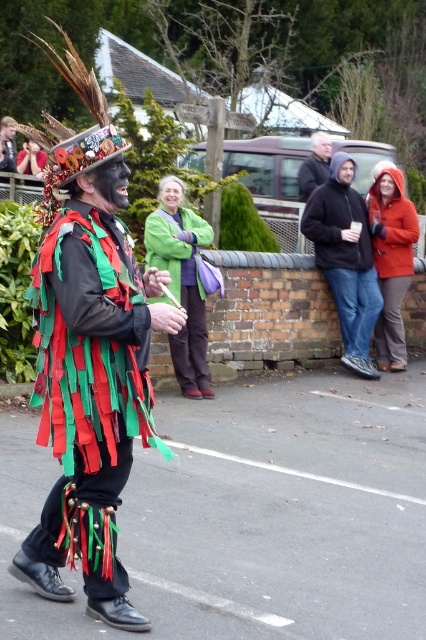
Between felt/tissue vest at center and orange fuzzy coat at right, which one has less height?

felt/tissue vest at center is shorter.

Based on the photo, between felt/tissue vest at center and orange fuzzy coat at right, which one has more height?

With more height is orange fuzzy coat at right.

Is point (60, 234) positioned in front of point (406, 257)?

That is True.

Find the location of a particular element. felt/tissue vest at center is located at coordinates (88, 397).

Which of these two, green fabric bag at center or dark blue jacket at center, stands taller?

green fabric bag at center

Measure the distance from green fabric bag at center to dark blue jacket at center.

green fabric bag at center is 4.22 meters from dark blue jacket at center.

Is point (180, 259) closer to viewer compared to point (314, 188)?

Yes, it is in front of point (314, 188).

Locate an element on the screen. This screenshot has height=640, width=426. green fabric bag at center is located at coordinates (183, 289).

Does felt/tissue vest at center have a lesser height compared to dark blue jacket at center?

Incorrect, felt/tissue vest at center's height does not fall short of dark blue jacket at center's.

Between felt/tissue vest at center and dark blue jacket at center, which one appears on the right side from the viewer's perspective?

Positioned to the right is dark blue jacket at center.

The width and height of the screenshot is (426, 640). In order to click on felt/tissue vest at center in this screenshot , I will do `click(88, 397)`.

This screenshot has height=640, width=426. I want to click on felt/tissue vest at center, so pyautogui.click(x=88, y=397).